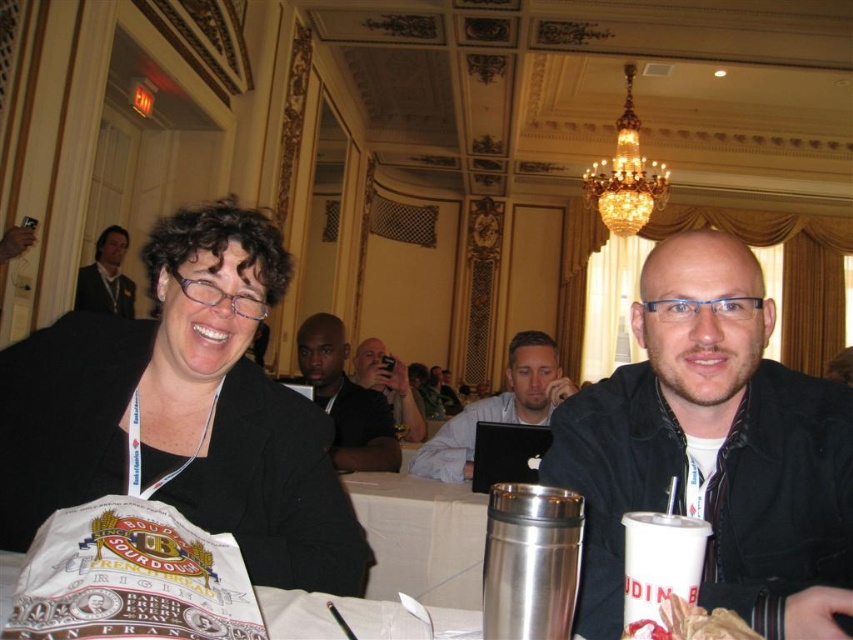
You are a photographer standing at the point marked as point (659,477). You need to take a photo of the woman with curly hair and glasses. Considering the distance between you and her, will you be able to capture her clearly in your shot without moving closer?

The distance between you at point (659,477) and the woman with curly hair and glasses is 1.33 meters. At this distance, it is possible to capture her clearly in the photo without moving closer, provided the camera has a suitable lens or zoom capability.

You are organizing a coat rack for an event and need to place the black matte jacket at right and the white paper cup at lower right. Since the coat rack has limited space, can you determine which item requires more horizontal space based on their sizes?

The black matte jacket at right requires more horizontal space because it is wider than the white paper cup at lower right.

From the picture: You are an event organizer checking the seating arrangement. You notice the black matte jacket at right and the white paper cup at lower right. Which object is covering the other?

The black matte jacket at right is positioned over white paper cup at lower right, so it is covering the cup.